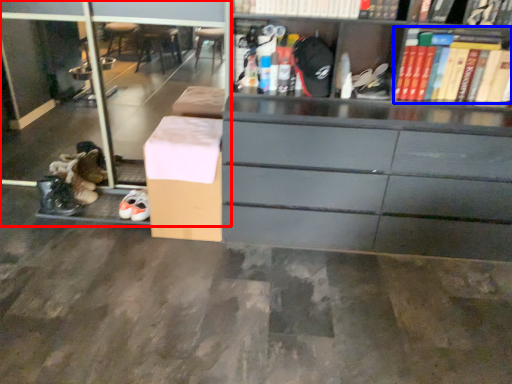
Question: Among these objects, which one is nearest to the camera, shelf (highlighted by a red box) or book (highlighted by a blue box)?

Choices:
 (A) shelf
 (B) book

Answer: (B)